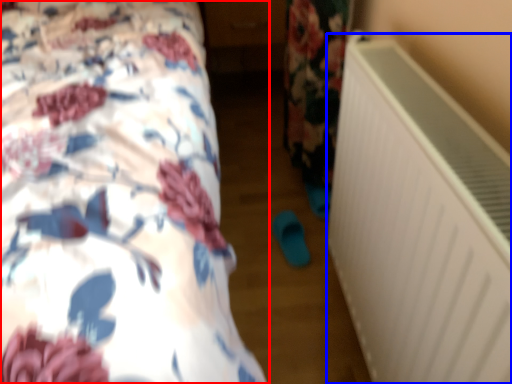
Question: Which point is further to the camera, bed (highlighted by a red box) or air conditioning (highlighted by a blue box)?

Choices:
 (A) bed
 (B) air conditioning

Answer: (B)